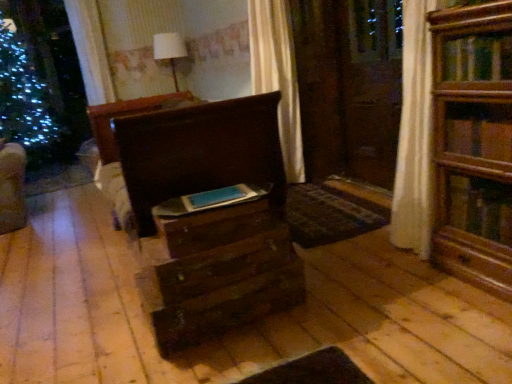
Image resolution: width=512 pixels, height=384 pixels. What are the coordinates of `vacant space underneath matte blue book at center (from a real-world perspective)` in the screenshot? It's located at (221, 193).